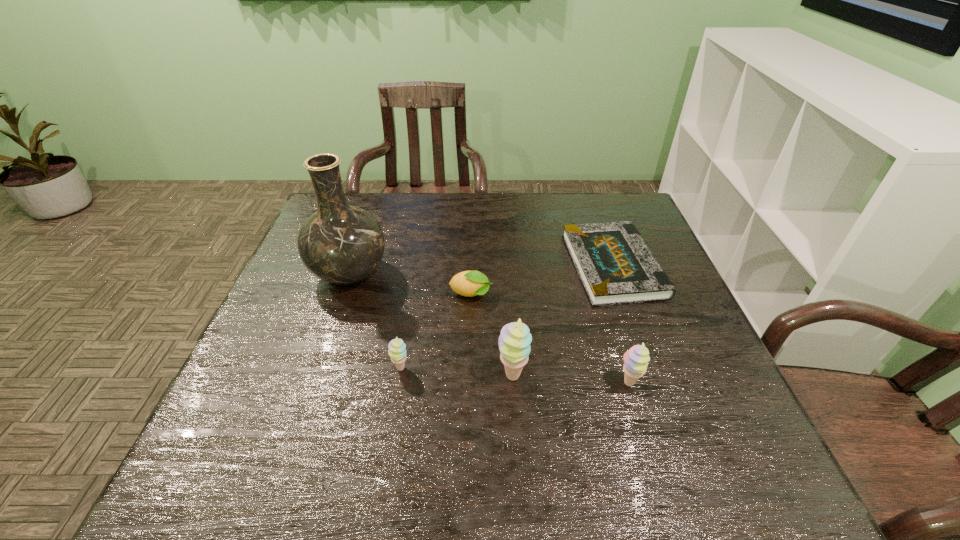
Locate an element on the screen. The height and width of the screenshot is (540, 960). object that is positioned at the far right corner is located at coordinates (615, 265).

At what (x,y) coordinates should I click in order to perform the action: click on vacant space at the far edge. Please return your answer as a coordinate pair (x, y). This screenshot has width=960, height=540. Looking at the image, I should click on (501, 193).

In order to click on blank space at the near edge of the desktop in this screenshot , I will do `click(657, 422)`.

Where is `vacant region at the left edge`? The image size is (960, 540). vacant region at the left edge is located at coordinates (292, 354).

Where is `blank space at the right edge of the desktop`? Image resolution: width=960 pixels, height=540 pixels. blank space at the right edge of the desktop is located at coordinates (684, 364).

You are a GUI agent. You are given a task and a screenshot of the screen. Output one action in this format:
    pyautogui.click(x=<x>, y=<y>)
    Task: Click on the free space at the far left corner
    
    Given the screenshot: What is the action you would take?
    pos(358,207)

Identify the location of free space at the far right corner. The width and height of the screenshot is (960, 540). pyautogui.click(x=596, y=218).

Find the location of a particular element. Image resolution: width=960 pixels, height=540 pixels. vacant area at the near right corner is located at coordinates (699, 417).

Find the location of a particular element. empty space between the notebook and the tallest sherbert is located at coordinates (563, 321).

At what (x,y) coordinates should I click in order to perform the action: click on free space between the notebook and the rightmost sherbert. Please return your answer as a coordinate pair (x, y). This screenshot has width=960, height=540. Looking at the image, I should click on (620, 325).